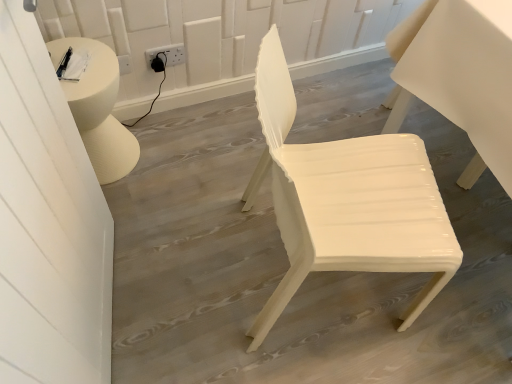
Question: Is white plastic outlet at upper center in front of or behind glossy white chair at center in the image?

Choices:
 (A) behind
 (B) front

Answer: (A)

Question: Based on their positions, is white plastic outlet at upper center located to the left or right of glossy white chair at center?

Choices:
 (A) left
 (B) right

Answer: (A)

Question: Is white plastic outlet at upper center taller or shorter than glossy white chair at center?

Choices:
 (A) short
 (B) tall

Answer: (A)

Question: In terms of height, does glossy white chair at center look taller or shorter compared to white plastic outlet at upper center?

Choices:
 (A) tall
 (B) short

Answer: (A)

Question: Is glossy white chair at center wider or thinner than white plastic outlet at upper center?

Choices:
 (A) wide
 (B) thin

Answer: (A)

Question: Based on their positions, is glossy white chair at center located to the left or right of white plastic outlet at upper center?

Choices:
 (A) left
 (B) right

Answer: (B)

Question: Considering the positions of point (261, 100) and point (169, 56), is point (261, 100) closer or farther from the camera than point (169, 56)?

Choices:
 (A) farther
 (B) closer

Answer: (B)